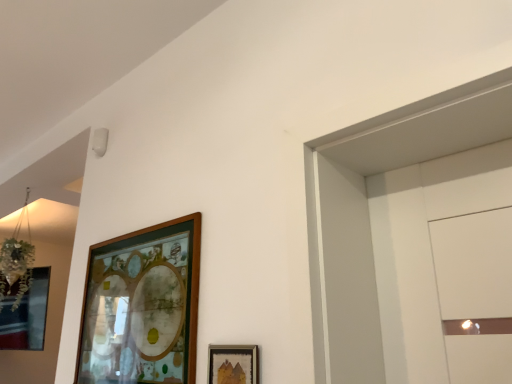
Question: Does wooden picture frame at upper center, placed as the second picture frame when sorted from right to left, have a smaller size compared to wooden frame at lower center, positioned as the first picture frame in right-to-left order?

Choices:
 (A) yes
 (B) no

Answer: (B)

Question: From a real-world perspective, does wooden picture frame at upper center, the first picture frame from the left, stand above wooden frame at lower center, positioned as the first picture frame in right-to-left order?

Choices:
 (A) no
 (B) yes

Answer: (B)

Question: Is wooden picture frame at upper center, marked as the first picture frame in a back-to-front arrangement, facing towards wooden frame at lower center, positioned as the first picture frame in right-to-left order?

Choices:
 (A) yes
 (B) no

Answer: (B)

Question: Is wooden picture frame at upper center, placed as the second picture frame when sorted from right to left, touching wooden frame at lower center, positioned as the first picture frame in right-to-left order?

Choices:
 (A) no
 (B) yes

Answer: (A)

Question: Can you confirm if wooden picture frame at upper center, the first picture frame from the left, is bigger than wooden frame at lower center, positioned as the second picture frame in left-to-right order?

Choices:
 (A) yes
 (B) no

Answer: (A)

Question: From a real-world perspective, does wooden picture frame at upper center, placed as the second picture frame when sorted from right to left, sit lower than wooden frame at lower center, which is the 1th picture frame in front-to-back order?

Choices:
 (A) yes
 (B) no

Answer: (B)

Question: From a real-world perspective, is wooden frame at lower center, the 2th picture frame in the back-to-front sequence, physically above wooden picture frame at upper center, placed as the second picture frame when sorted from right to left?

Choices:
 (A) yes
 (B) no

Answer: (B)

Question: Is wooden frame at lower center, positioned as the first picture frame in right-to-left order, completely or partially outside of wooden picture frame at upper center, the first picture frame from the left?

Choices:
 (A) no
 (B) yes

Answer: (B)

Question: Would you consider wooden frame at lower center, which is the 1th picture frame in front-to-back order, to be distant from wooden picture frame at upper center, marked as the first picture frame in a back-to-front arrangement?

Choices:
 (A) yes
 (B) no

Answer: (B)

Question: Does wooden frame at lower center, positioned as the second picture frame in left-to-right order, have a greater width compared to wooden picture frame at upper center, marked as the first picture frame in a back-to-front arrangement?

Choices:
 (A) no
 (B) yes

Answer: (A)

Question: From a real-world perspective, is wooden frame at lower center, positioned as the first picture frame in right-to-left order, beneath wooden picture frame at upper center, the first picture frame from the left?

Choices:
 (A) yes
 (B) no

Answer: (A)

Question: Is wooden frame at lower center, which is the 1th picture frame in front-to-back order, at the left side of wooden picture frame at upper center, which is counted as the second picture frame, starting from the front?

Choices:
 (A) yes
 (B) no

Answer: (B)

Question: Relative to wooden frame at lower center, positioned as the first picture frame in right-to-left order, is wooden picture frame at upper center, marked as the first picture frame in a back-to-front arrangement, in front or behind?

Choices:
 (A) front
 (B) behind

Answer: (B)